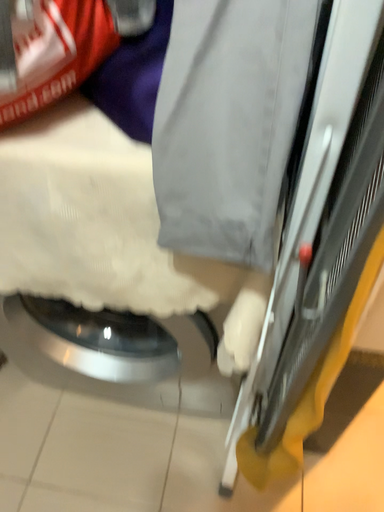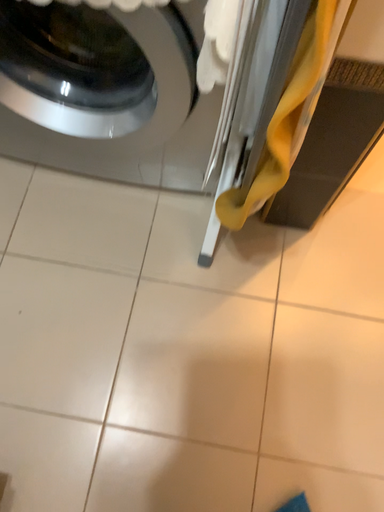
Question: Which way did the camera rotate in the video?

Choices:
 (A) rotated upward
 (B) rotated downward

Answer: (B)